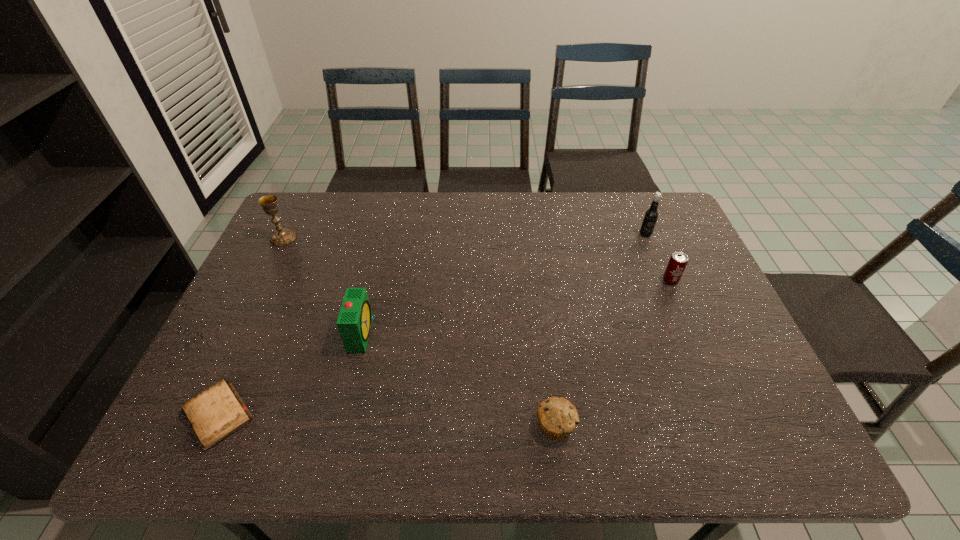
Locate an element on the screen. The image size is (960, 540). vacant space at the far left corner is located at coordinates (305, 208).

What are the coordinates of `vacant space at the far right corner of the desktop` in the screenshot? It's located at (637, 214).

Where is `vacant space that's between the root beer and the diary`? vacant space that's between the root beer and the diary is located at coordinates (432, 325).

At what (x,y) coordinates should I click in order to perform the action: click on free area in between the third object from left to right and the muffin. Please return your answer as a coordinate pair (x, y). This screenshot has height=540, width=960. Looking at the image, I should click on (458, 380).

Find the location of a particular element. The height and width of the screenshot is (540, 960). free space between the chalice and the root beer is located at coordinates (465, 237).

The height and width of the screenshot is (540, 960). In order to click on free space between the fourth nearest object and the shortest object in this screenshot , I will do `click(444, 348)`.

The image size is (960, 540). In order to click on vacant space in between the fifth tallest object and the chalice in this screenshot , I will do [x=420, y=332].

Where is `free point between the root beer and the diary`? This screenshot has height=540, width=960. free point between the root beer and the diary is located at coordinates (432, 325).

Find the location of a particular element. This screenshot has height=540, width=960. empty location between the root beer and the shortest object is located at coordinates (432, 325).

Identify the location of vacant space in between the diary and the fourth object from right to left. This screenshot has height=540, width=960. (290, 374).